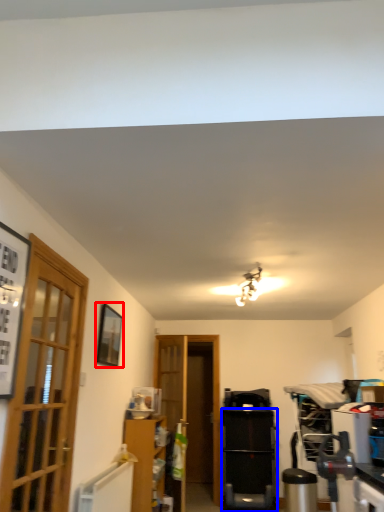
Question: Which point is closer to the camera, picture frame (highlighted by a red box) or appliance (highlighted by a blue box)?

Choices:
 (A) picture frame
 (B) appliance

Answer: (A)